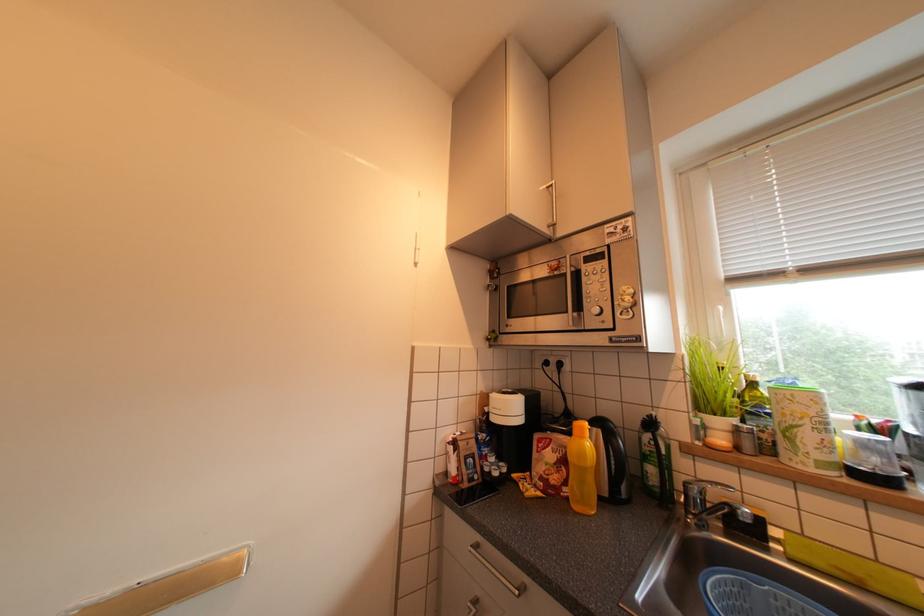
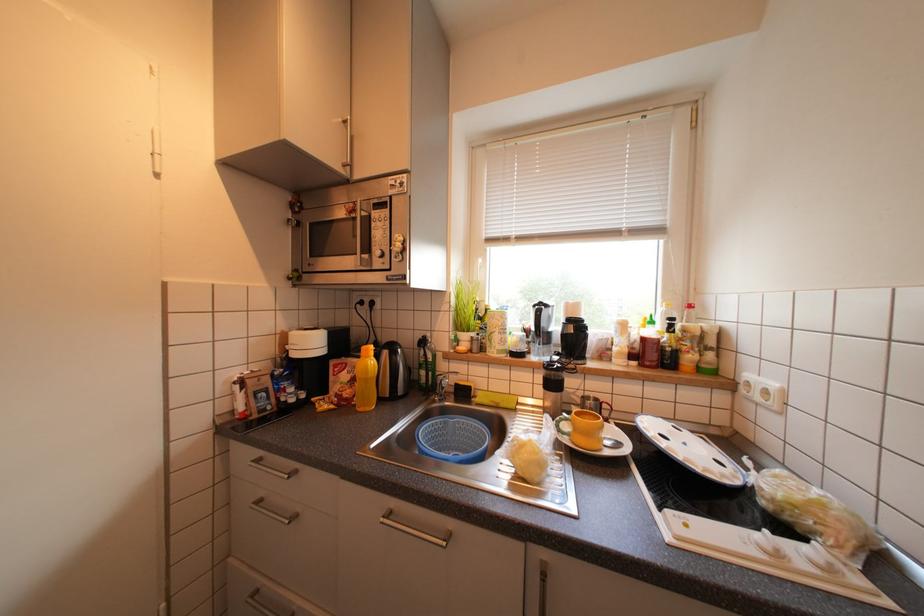
Question: The camera is either moving clockwise (left) or counter-clockwise (right) around the object. The first image is from the beginning of the video and the second image is from the end. Is the camera moving left or right when shooting the video?

Choices:
 (A) Left
 (B) Right

Answer: (A)